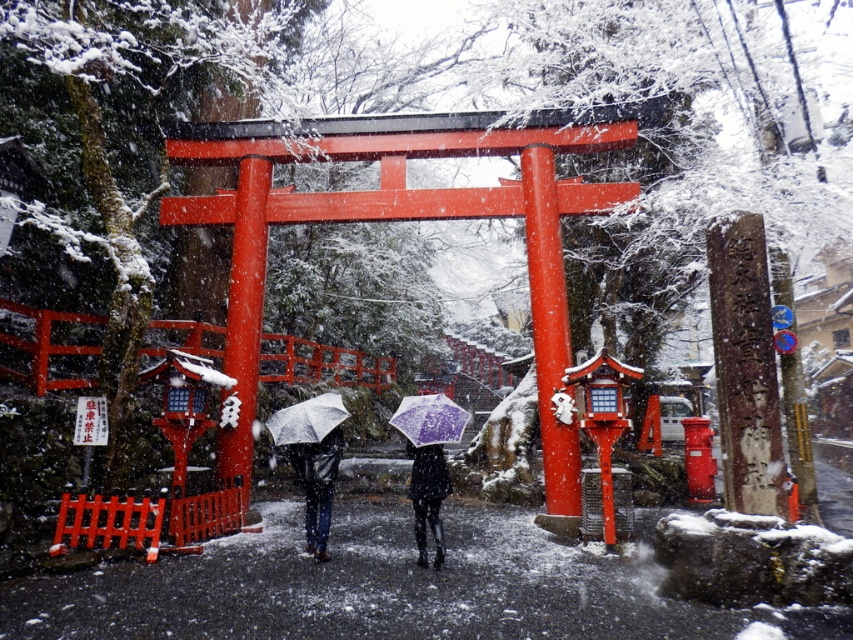
Is purple matte umbrella at center positioned before transparent purple umbrella at center?

Yes.

Find the location of a particular element. The image size is (853, 640). purple matte umbrella at center is located at coordinates (428, 419).

You are a GUI agent. You are given a task and a screenshot of the screen. Output one action in this format:
    pyautogui.click(x=<x>, y=<y>)
    Task: Click on the purple matte umbrella at center
    The width and height of the screenshot is (853, 640).
    Given the screenshot: What is the action you would take?
    pyautogui.click(x=428, y=419)

Is matte black jacket at center below purple matte umbrella at center?

Correct, matte black jacket at center is located below purple matte umbrella at center.

Does matte black jacket at center lie in front of purple matte umbrella at center?

No, matte black jacket at center is further to the viewer.

What do you see at coordinates (317, 484) in the screenshot? This screenshot has height=640, width=853. I see `matte black jacket at center` at bounding box center [317, 484].

Where is `matte black jacket at center`? This screenshot has width=853, height=640. matte black jacket at center is located at coordinates (317, 484).

Is black matte coat at center above transparent purple umbrella at center?

No.

Who is positioned more to the right, black matte coat at center or transparent purple umbrella at center?

Positioned to the right is black matte coat at center.

Locate an element on the screen. black matte coat at center is located at coordinates click(x=427, y=497).